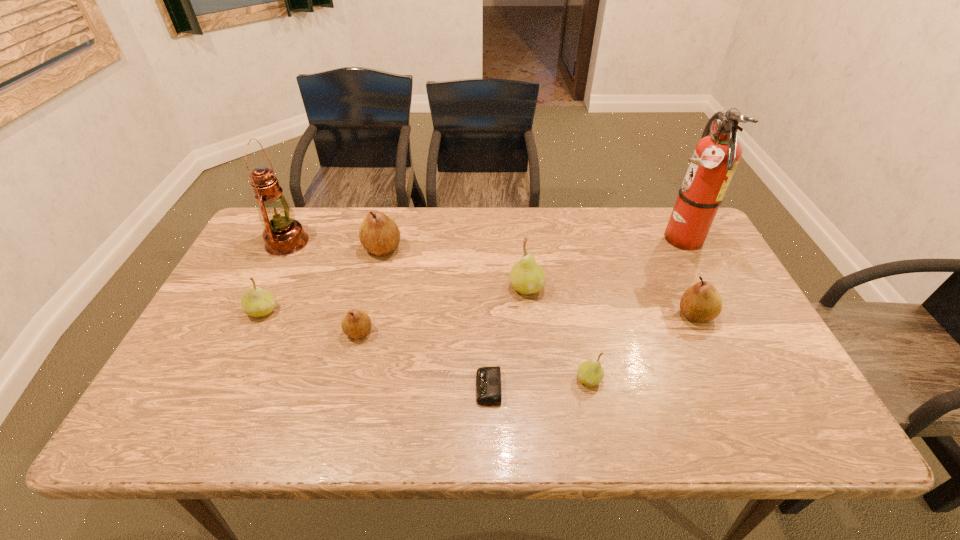
This screenshot has width=960, height=540. I want to click on the closest brown pear to the biggest brown pear, so click(x=355, y=323).

Where is `the second closest green pear relative to the rightmost green pear`? Image resolution: width=960 pixels, height=540 pixels. the second closest green pear relative to the rightmost green pear is located at coordinates (256, 302).

Locate an element on the screen. The height and width of the screenshot is (540, 960). the third closest green pear to the rightmost pear is located at coordinates (256, 302).

The image size is (960, 540). Find the location of `free space that satisfies the following two spatial constraints: 1. on the front side of the leftmost green pear; 2. on the left side of the second pear from right to left`. free space that satisfies the following two spatial constraints: 1. on the front side of the leftmost green pear; 2. on the left side of the second pear from right to left is located at coordinates (230, 379).

Where is `vacant region that satisfies the following two spatial constraints: 1. from the nozzle of the red fire extinguisher; 2. on the front side of the third object from right to left`? The image size is (960, 540). vacant region that satisfies the following two spatial constraints: 1. from the nozzle of the red fire extinguisher; 2. on the front side of the third object from right to left is located at coordinates (749, 379).